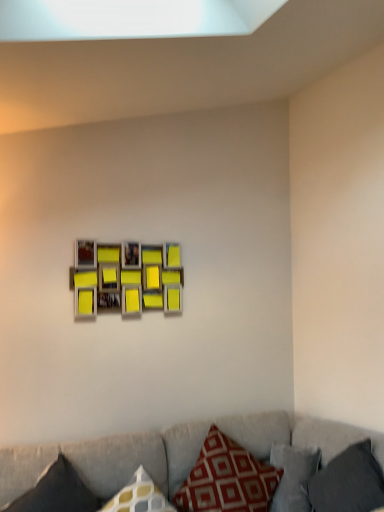
Question: Is the position of matte yellow picture frame at center more distant than that of textured gray couch at lower center?

Choices:
 (A) no
 (B) yes

Answer: (B)

Question: Considering the relative sizes of matte yellow picture frame at center and textured gray couch at lower center in the image provided, is matte yellow picture frame at center thinner than textured gray couch at lower center?

Choices:
 (A) no
 (B) yes

Answer: (B)

Question: Is textured gray couch at lower center a part of matte yellow picture frame at center?

Choices:
 (A) no
 (B) yes

Answer: (A)

Question: Is matte yellow picture frame at center oriented away from textured gray couch at lower center?

Choices:
 (A) yes
 (B) no

Answer: (B)

Question: Is matte yellow picture frame at center next to textured gray couch at lower center?

Choices:
 (A) yes
 (B) no

Answer: (B)

Question: Considering the positions of red printed cushion at lower center, placed as the second pillow when sorted from right to left, and dark gray fabric pillow at lower right, arranged as the third pillow when viewed from the left, in the image, is red printed cushion at lower center, placed as the second pillow when sorted from right to left, wider or thinner than dark gray fabric pillow at lower right, arranged as the third pillow when viewed from the left,?

Choices:
 (A) thin
 (B) wide

Answer: (B)

Question: From the image's perspective, relative to dark gray fabric pillow at lower right, arranged as the third pillow when viewed from the left, is red printed cushion at lower center, placed as the second pillow when sorted from right to left, above or below?

Choices:
 (A) below
 (B) above

Answer: (A)

Question: Considering their positions, is red printed cushion at lower center, the 2th pillow from the left, located in front of or behind dark gray fabric pillow at lower right, arranged as the third pillow when viewed from the left?

Choices:
 (A) front
 (B) behind

Answer: (B)

Question: Is point click(203, 457) closer or farther from the camera than point click(377, 496)?

Choices:
 (A) closer
 (B) farther

Answer: (B)

Question: In terms of width, does matte yellow picture frame at center look wider or thinner when compared to textured gray couch at lower center?

Choices:
 (A) thin
 (B) wide

Answer: (A)

Question: From the image's perspective, is matte yellow picture frame at center located above or below textured gray couch at lower center?

Choices:
 (A) above
 (B) below

Answer: (A)

Question: Visually, is matte yellow picture frame at center positioned to the left or to the right of textured gray couch at lower center?

Choices:
 (A) left
 (B) right

Answer: (A)

Question: Is point [163, 261] positioned closer to the camera than point [349, 431]?

Choices:
 (A) farther
 (B) closer

Answer: (A)

Question: From the image's perspective, is red printed cushion at lower center, placed as the second pillow when sorted from right to left, above or below dark gray fabric pillow at lower left, the 3th pillow positioned from the right?

Choices:
 (A) below
 (B) above

Answer: (A)

Question: Is red printed cushion at lower center, placed as the second pillow when sorted from right to left, inside or outside of dark gray fabric pillow at lower left, the 3th pillow positioned from the right?

Choices:
 (A) inside
 (B) outside

Answer: (B)